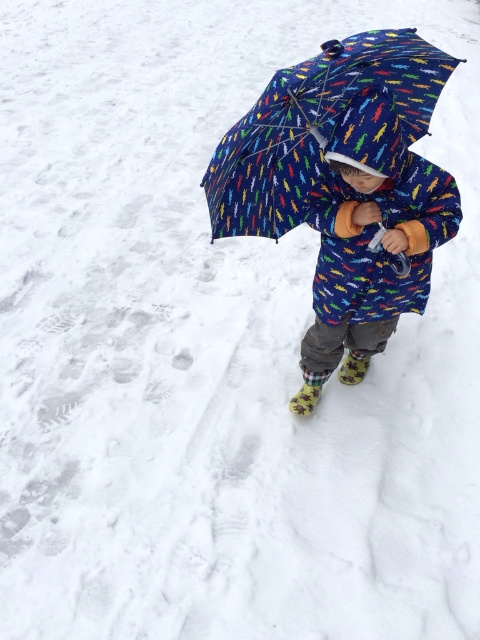
Is printed fabric umbrella at center taller than blue fabric umbrella at center?

Yes.

Can you confirm if printed fabric umbrella at center is smaller than blue fabric umbrella at center?

No.

You are a GUI agent. You are given a task and a screenshot of the screen. Output one action in this format:
    pyautogui.click(x=<x>, y=<y>)
    Task: Click on the printed fabric umbrella at center
    The image size is (480, 640).
    Given the screenshot: What is the action you would take?
    pyautogui.click(x=370, y=240)